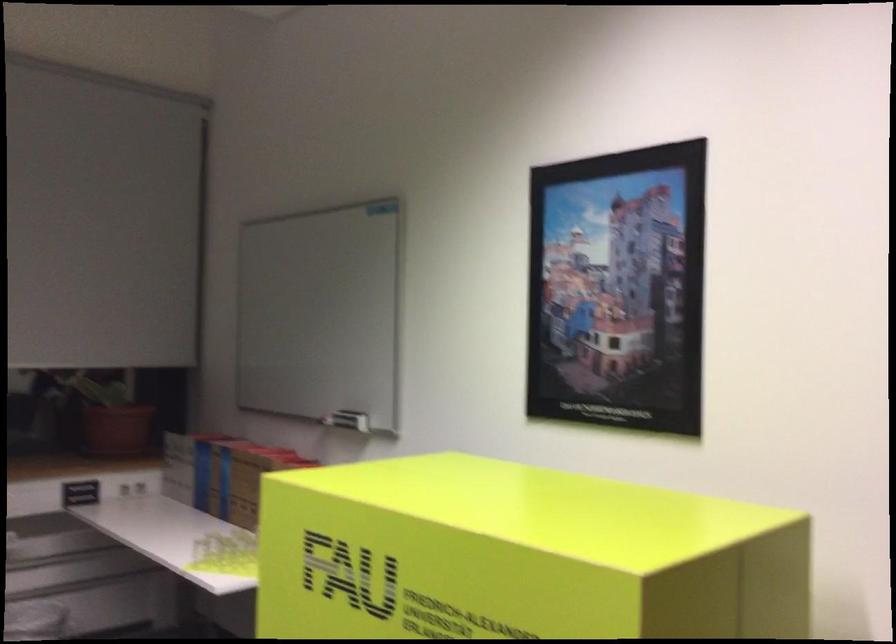
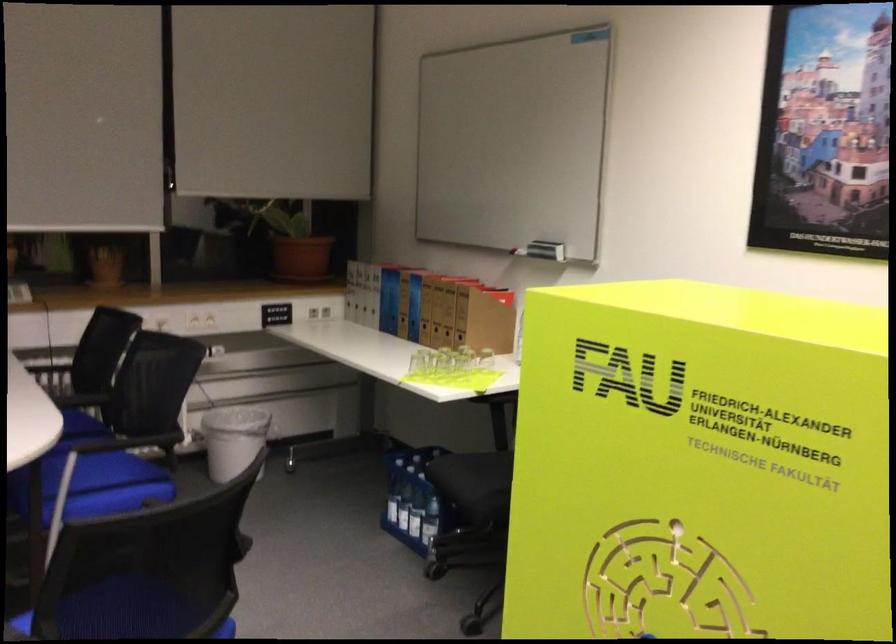
The point at [197,495] is marked in the first image. Where is the corresponding point in the second image?

(382, 321)